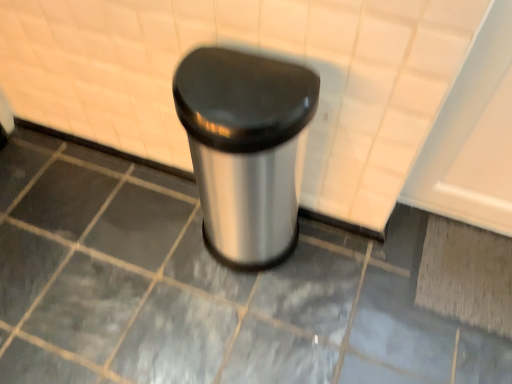
I want to click on free space above polished stainless steel trash can at center (from a real-world perspective), so click(237, 84).